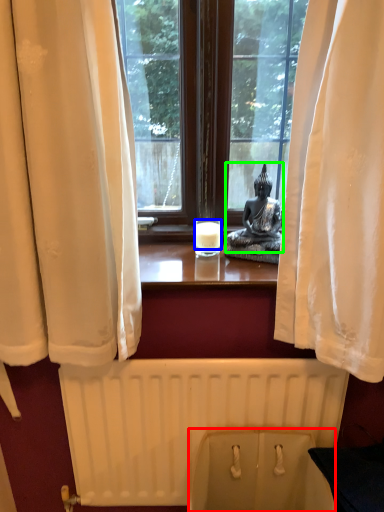
Question: Which object is the farthest from toilet bowl (highlighted by a red box)? Choose among these: candle (highlighted by a blue box) or person (highlighted by a green box).

Choices:
 (A) candle
 (B) person

Answer: (A)